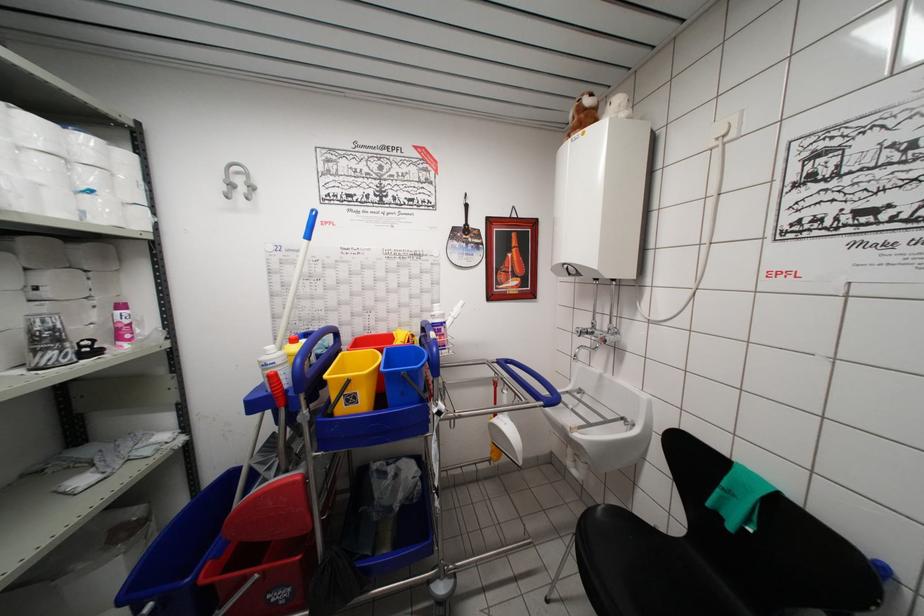
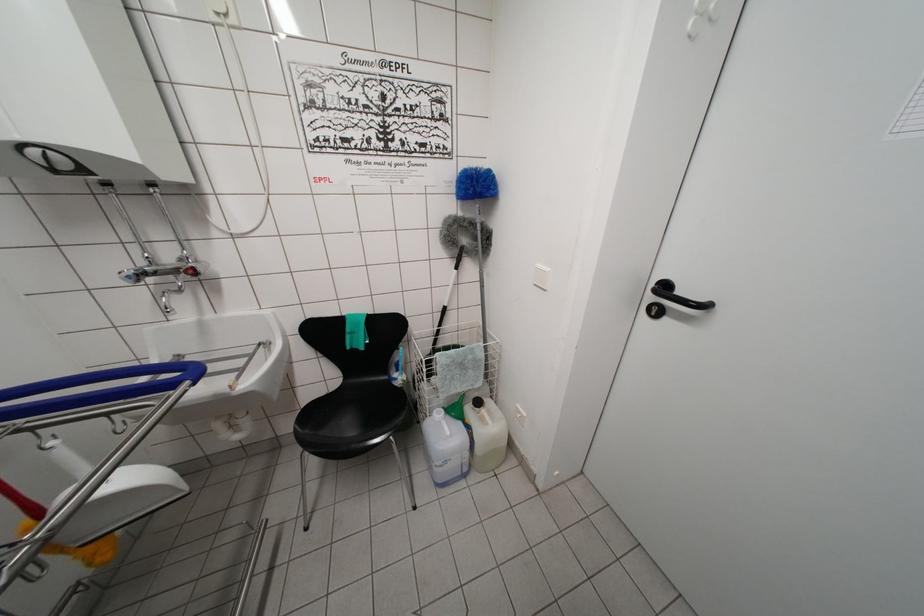
Locate, in the second image, the point that corresponds to [673,539] in the first image.

(335, 395)